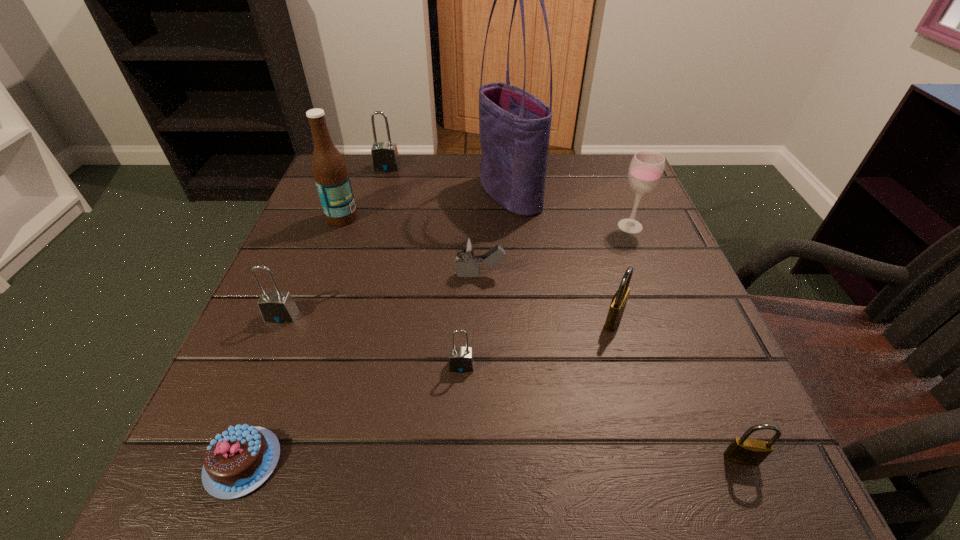
What are the coordinates of `vacant region between the pink chocolate cake and the left brass padlock` in the screenshot? It's located at (428, 391).

This screenshot has width=960, height=540. I want to click on vacant space that's between the left brass padlock and the purple tote bag, so click(562, 257).

Image resolution: width=960 pixels, height=540 pixels. In order to click on free space between the wineglass and the tote bag in this screenshot , I will do `click(570, 210)`.

Identify which object is the fifth nearest to the farthest object. Please provide its 2D coordinates. Your answer should be formatted as a tuple, i.e. [(x, y)], where the tuple contains the x and y coordinates of a point satisfying the conditions above.

[(646, 169)]

In order to click on the fourth closest object to the smallest gray padlock in this screenshot , I will do `click(277, 306)`.

Select which padlock is the second closest to the second smallest gray padlock. Please provide its 2D coordinates. Your answer should be formatted as a tuple, i.e. [(x, y)], where the tuple contains the x and y coordinates of a point satisfying the conditions above.

[(385, 158)]

Identify which padlock is located as the second nearest to the wineglass. Please provide its 2D coordinates. Your answer should be formatted as a tuple, i.e. [(x, y)], where the tuple contains the x and y coordinates of a point satisfying the conditions above.

[(461, 360)]

At what (x,y) coordinates should I click in order to perform the action: click on the third closest gray padlock to the bigger brass padlock. Please return your answer as a coordinate pair (x, y). Looking at the image, I should click on (385, 158).

At what (x,y) coordinates should I click in order to perform the action: click on gray padlock that is the nearest to the second smallest gray padlock. Please return your answer as a coordinate pair (x, y). This screenshot has height=540, width=960. Looking at the image, I should click on (461, 360).

Find the location of a particular element. This screenshot has width=960, height=540. free space that satisfies the following two spatial constraints: 1. on the front side of the left brass padlock; 2. on the right side of the nearest padlock is located at coordinates point(653,458).